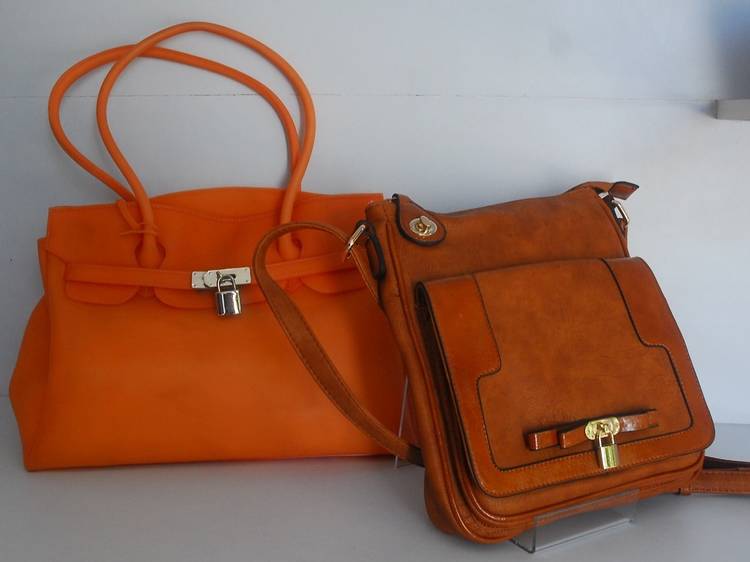
Locate an element on the screen. shelf edge is located at coordinates (736, 111).